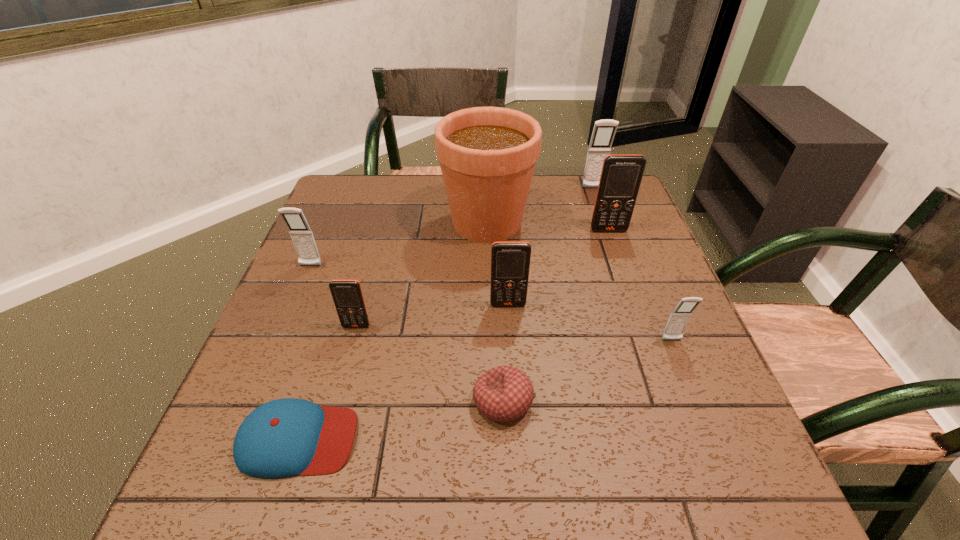
Image resolution: width=960 pixels, height=540 pixels. What are the coordinates of `vacant space at the near edge of the desktop` in the screenshot? It's located at (429, 469).

Identify the location of free region at the left edge. This screenshot has height=540, width=960. click(x=332, y=273).

Find the location of a particular element. free point at the right edge is located at coordinates 638,295.

Locate an element on the screen. This screenshot has width=960, height=540. free spot at the far left corner of the desktop is located at coordinates (318, 217).

In the image, there is a desktop. Identify the location of vacant space at the near left corner. (276, 517).

The width and height of the screenshot is (960, 540). In order to click on blank region between the fifth farthest cellular telephone and the beanbag in this screenshot , I will do `click(429, 363)`.

Identify the location of unoccupied area between the beanbag and the baseball cap. The height and width of the screenshot is (540, 960). (400, 420).

What are the coordinates of `free space between the second nearest cellular telephone and the beanbag` in the screenshot? It's located at (429, 363).

Where is `vacant space that's between the smallest orange cellular telephone and the beanbag`? The image size is (960, 540). vacant space that's between the smallest orange cellular telephone and the beanbag is located at coordinates (429, 363).

Locate an element on the screen. Image resolution: width=960 pixels, height=540 pixels. vacant region between the baseball cap and the fourth farthest cellular telephone is located at coordinates (403, 372).